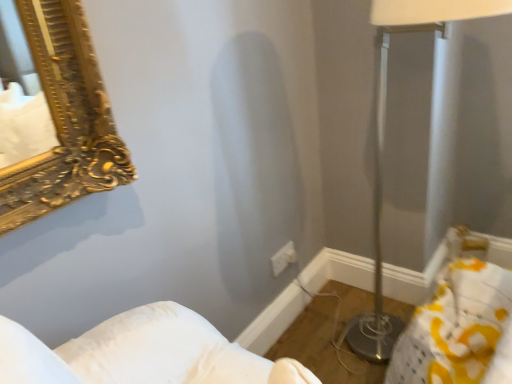
Question: Looking at their shapes, would you say white plastic electric outlet at center is wider or thinner than metallic silver table lamp at right?

Choices:
 (A) thin
 (B) wide

Answer: (A)

Question: From the image's perspective, is white plastic electric outlet at center positioned above or below metallic silver table lamp at right?

Choices:
 (A) above
 (B) below

Answer: (B)

Question: From their relative heights in the image, would you say white plastic electric outlet at center is taller or shorter than metallic silver table lamp at right?

Choices:
 (A) tall
 (B) short

Answer: (B)

Question: From the image's perspective, is metallic silver table lamp at right located above or below white plastic electric outlet at center?

Choices:
 (A) below
 (B) above

Answer: (B)

Question: Does point (370, 314) appear closer or farther from the camera than point (292, 256)?

Choices:
 (A) farther
 (B) closer

Answer: (A)

Question: Considering the positions of metallic silver table lamp at right and white plastic electric outlet at center in the image, is metallic silver table lamp at right bigger or smaller than white plastic electric outlet at center?

Choices:
 (A) big
 (B) small

Answer: (A)

Question: Considering the positions of metallic silver table lamp at right and white plastic electric outlet at center in the image, is metallic silver table lamp at right taller or shorter than white plastic electric outlet at center?

Choices:
 (A) short
 (B) tall

Answer: (B)